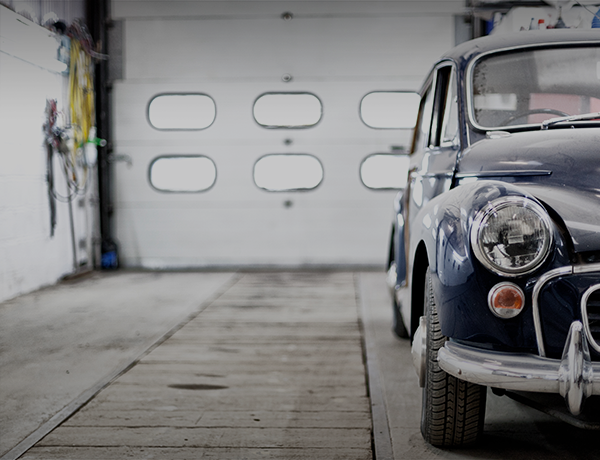
Locate an element on the screen. This screenshot has width=600, height=460. windows in garage door is located at coordinates (177, 111), (177, 180), (278, 179), (286, 104), (388, 108), (388, 169).